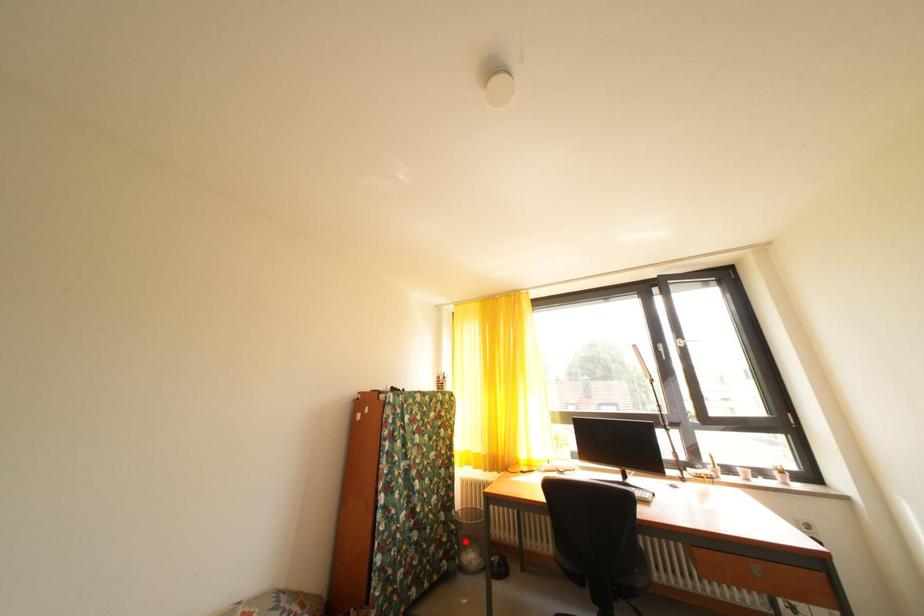
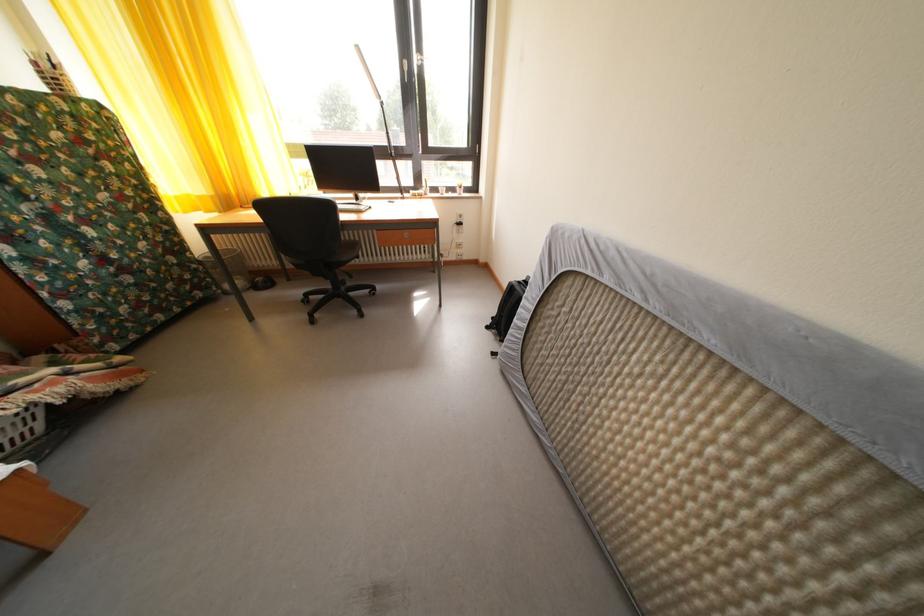
Where in the second image is the point corresponding to the highlighted location from the first image?

(215, 278)